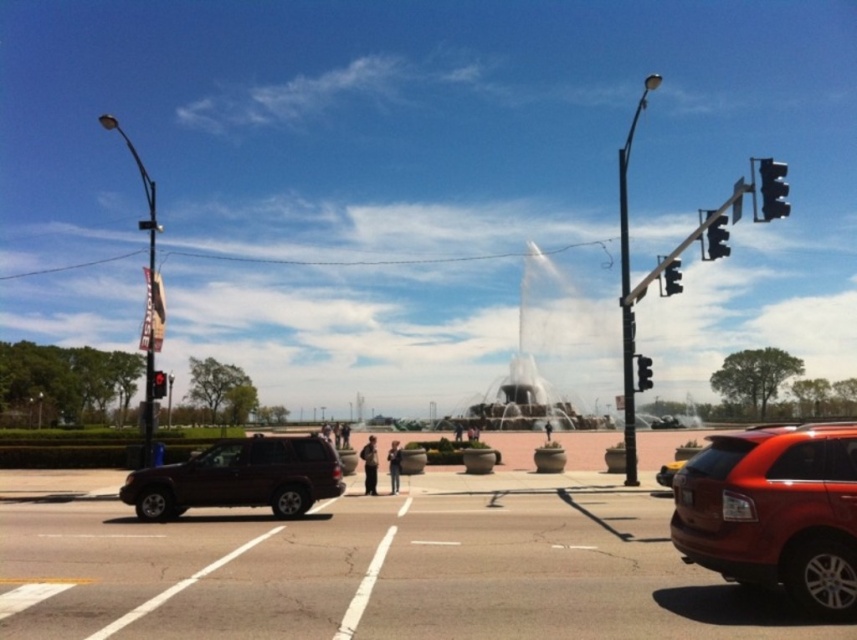
Question: Which of the following is the farthest from the observer?

Choices:
 (A) black plastic traffic light at upper right
 (B) dark gray fabric jacket at center
 (C) red glass traffic light at left

Answer: (C)

Question: Is dark gray fabric jacket at center wider than smooth skin person at center?

Choices:
 (A) yes
 (B) no

Answer: (B)

Question: Estimate the real-world distances between objects in this image. Which object is closer to the smooth skin person at center?

Choices:
 (A) white stone fountain at center
 (B) dark gray fabric jacket at center
 (C) matte black suv at center
 (D) matte red suv at right

Answer: (B)

Question: Is red matte traffic light at upper right wider than dark blue jeans at center?

Choices:
 (A) yes
 (B) no

Answer: (A)

Question: Which point is closer to the camera taking this photo?

Choices:
 (A) (723, 230)
 (B) (670, 259)
 (C) (363, 460)

Answer: (A)

Question: Is metallic traffic light at center right further to camera compared to smooth skin person at center?

Choices:
 (A) no
 (B) yes

Answer: (A)